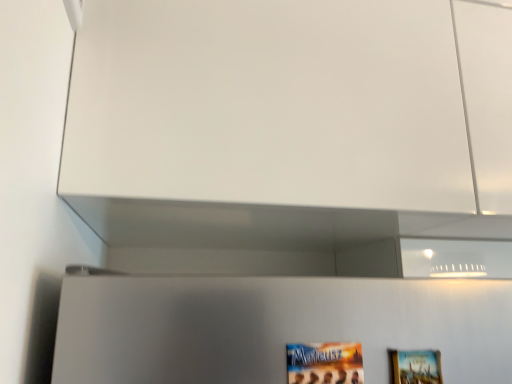
Question: Could matte paper movie poster at lower center be considered to be inside wooden picture frame at lower right?

Choices:
 (A) yes
 (B) no

Answer: (B)

Question: Considering the relative sizes of wooden picture frame at lower right and matte paper movie poster at lower center in the image provided, is wooden picture frame at lower right shorter than matte paper movie poster at lower center?

Choices:
 (A) no
 (B) yes

Answer: (A)

Question: Is wooden picture frame at lower right positioned beyond the bounds of matte paper movie poster at lower center?

Choices:
 (A) yes
 (B) no

Answer: (A)

Question: Is wooden picture frame at lower right aimed at matte paper movie poster at lower center?

Choices:
 (A) yes
 (B) no

Answer: (B)

Question: Considering the relative sizes of wooden picture frame at lower right and matte paper movie poster at lower center in the image provided, is wooden picture frame at lower right taller than matte paper movie poster at lower center?

Choices:
 (A) yes
 (B) no

Answer: (A)

Question: Does wooden picture frame at lower right appear on the left side of matte paper movie poster at lower center?

Choices:
 (A) yes
 (B) no

Answer: (B)

Question: Does matte paper movie poster at lower center touch wooden picture frame at lower right?

Choices:
 (A) no
 (B) yes

Answer: (B)

Question: From the image's perspective, is matte paper movie poster at lower center over wooden picture frame at lower right?

Choices:
 (A) no
 (B) yes

Answer: (B)

Question: Is matte paper movie poster at lower center oriented away from wooden picture frame at lower right?

Choices:
 (A) yes
 (B) no

Answer: (B)

Question: Does matte paper movie poster at lower center appear on the left side of wooden picture frame at lower right?

Choices:
 (A) no
 (B) yes

Answer: (B)

Question: Can you confirm if matte paper movie poster at lower center is thinner than wooden picture frame at lower right?

Choices:
 (A) no
 (B) yes

Answer: (B)

Question: Is matte paper movie poster at lower center wider than wooden picture frame at lower right?

Choices:
 (A) no
 (B) yes

Answer: (A)

Question: Based on their sizes in the image, would you say wooden picture frame at lower right is bigger or smaller than matte paper movie poster at lower center?

Choices:
 (A) big
 (B) small

Answer: (A)